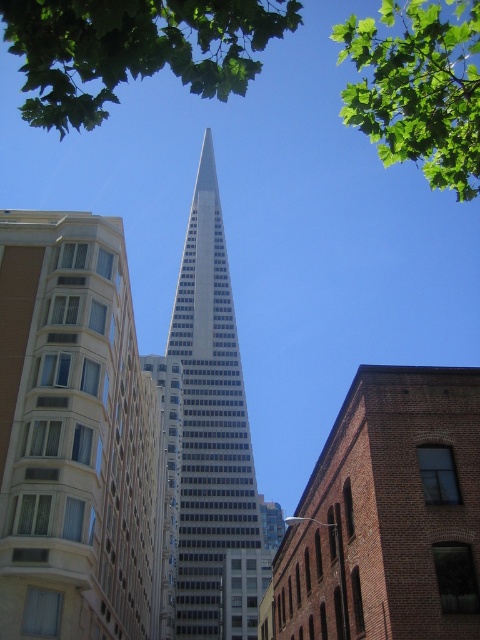
Consider the image. You are an architect designing a new park in the city. You want to ensure that the green leafy tree at upper center is visible from the silver glass skyscraper at center. Based on their sizes, is this possible? Please explain your reasoning.

The silver glass skyscraper at center has a smaller size compared to green leafy tree at upper center. Since the tree is larger, it would likely obstruct the view from the skyscraper, making it difficult to see the tree from there.

In the scene shown: You are standing at the base of the skyscraper and want to take a photo of the point at coordinates point (431, 579). If your camera has a maximum focus range of 30 meters, will it be able to focus on that point?

The distance of point (431, 579) from camera is 29.46 meters, so yes, the camera can focus on the point since it is within the 30 meters range.